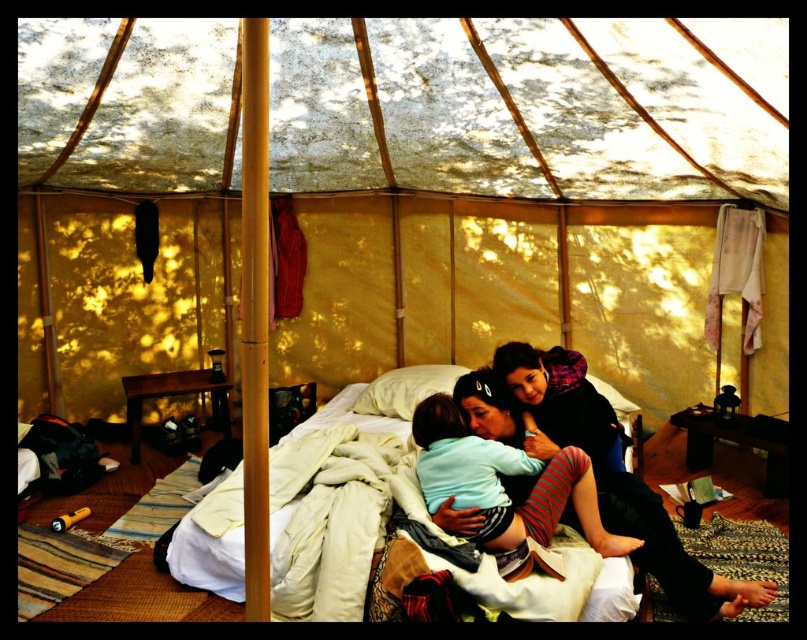
You are setting up a tent for a family camping trip and want to ensure the transparent fabric canopy at upper center provides shade for the white soft bed at center. Based on the scene description, does the canopy cover the bed adequately?

The transparent fabric canopy at upper center is positioned over the white soft bed at center, so it does provide shade for the bed.

You are setting up a tent and want to place a decorative pillow on the bed. The transparent fabric canopy at upper center is in the way. Can you move the white soft pillow at center to the right to make space for the new pillow?

The transparent fabric canopy at upper center is to the left of the white soft pillow at center. Moving the white soft pillow at center to the right would create space between the pillow and the canopy, allowing room for the new decorative pillow.

You are planning to set up a tent for a family camping trip. You have a transparent fabric canopy at upper center and a white soft pillow at center. Which object would you need to adjust if you want to increase the amount of sunlight entering the tent?

The transparent fabric canopy at upper center is bigger than the white soft pillow at center. To increase sunlight, you should adjust the transparent fabric canopy at upper center since it is larger and may block more light if obstructed.